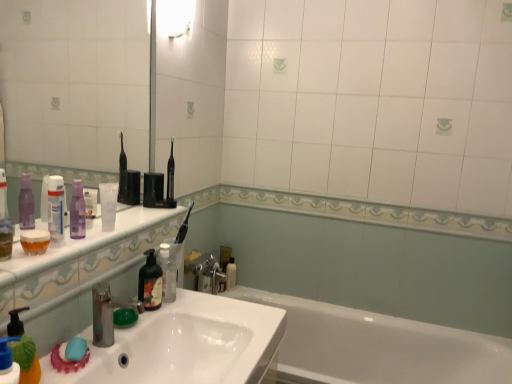
Find the location of a particular element. vacant space behind white matte tube at center, arranged as the 1th mouthwash when viewed from the left is located at coordinates (130, 221).